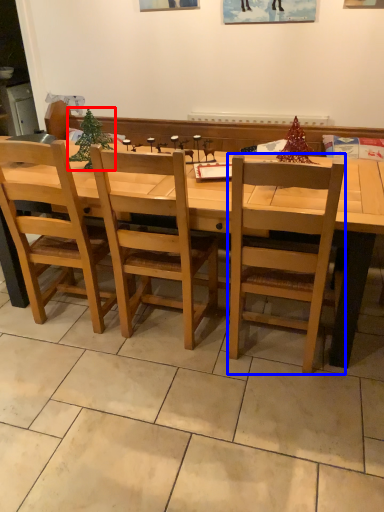
Question: Which object is further to the camera taking this photo, christmas tree (highlighted by a red box) or chair (highlighted by a blue box)?

Choices:
 (A) christmas tree
 (B) chair

Answer: (A)